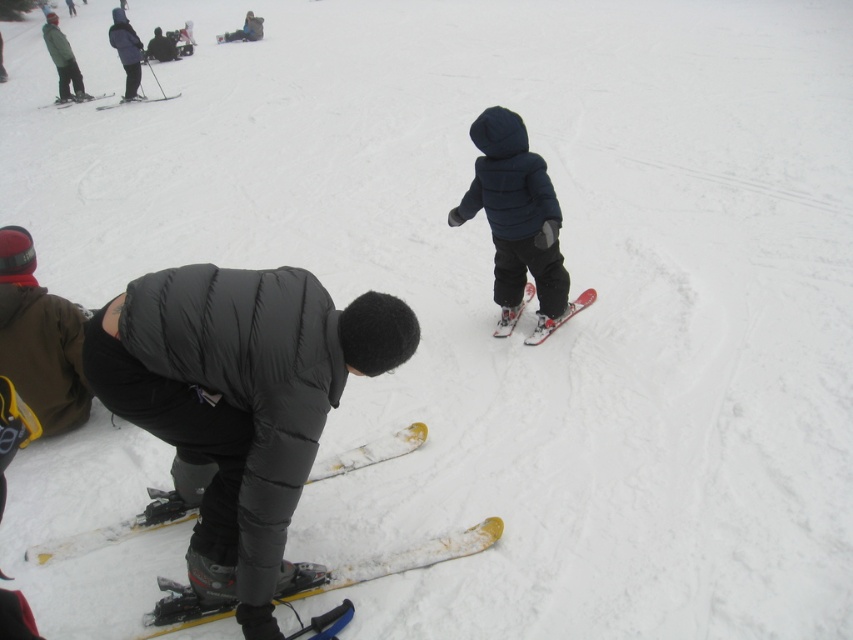
Question: Which point appears closest to the camera in this image?

Choices:
 (A) (154, 100)
 (B) (49, 545)
 (C) (67, 100)
 (D) (593, 298)

Answer: (B)

Question: Is yellow metallic ski at lower center wider than yellow matte skis at lower center?

Choices:
 (A) yes
 (B) no

Answer: (A)

Question: Which object is closer to the camera taking this photo?

Choices:
 (A) yellow metallic ski at lower center
 (B) yellow matte skis at lower center
 (C) dark blue puffy jacket at center
 (D) red plastic ski at center

Answer: (A)

Question: Can you confirm if dark blue puffy jacket at center is smaller than yellow metallic ski at lower center?

Choices:
 (A) yes
 (B) no

Answer: (B)

Question: Is yellow matte skis at lower center positioned in front of yellow matte ski at upper left?

Choices:
 (A) no
 (B) yes

Answer: (B)

Question: Which object is farther from the camera taking this photo?

Choices:
 (A) red plastic ski at center
 (B) yellow plastic ski at upper left
 (C) yellow matte ski at upper left

Answer: (B)